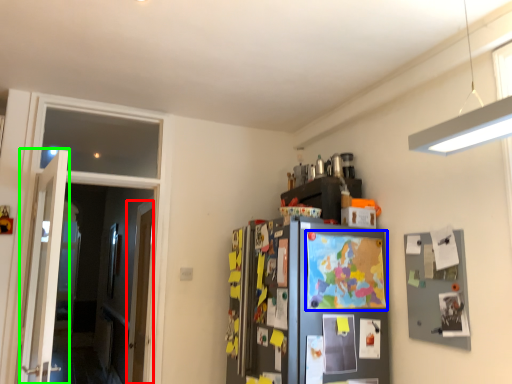
Question: Which is nearer to the door (highlighted by a red box)? map (highlighted by a blue box) or door (highlighted by a green box).

Choices:
 (A) map
 (B) door

Answer: (B)